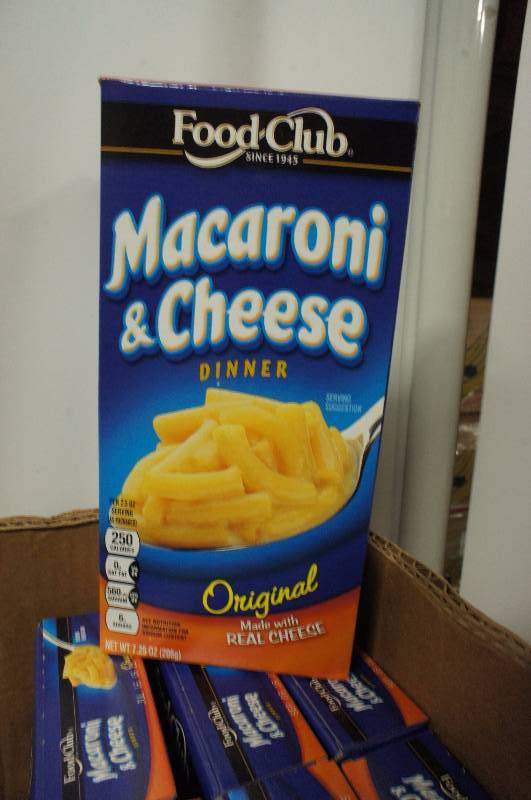
The image size is (531, 800). I want to click on spoon, so click(370, 428), click(55, 642).